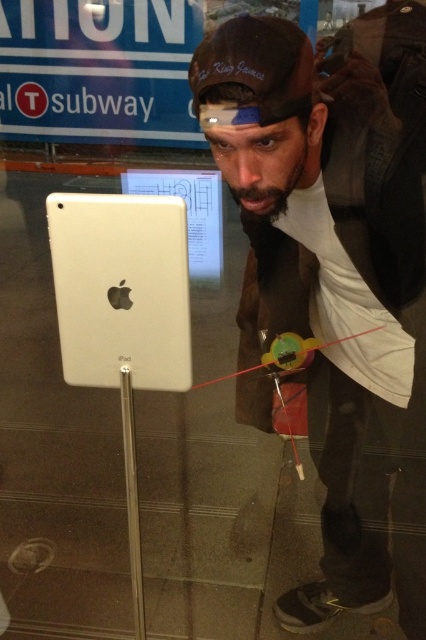
Question: Which point appears closest to the camera in this image?

Choices:
 (A) (368, 332)
 (B) (138, 529)

Answer: (B)

Question: Does white matte ipad at center appear over green plastic toy at center?

Choices:
 (A) yes
 (B) no

Answer: (A)

Question: Does white matte ipad at center have a lesser width compared to green plastic toy at center?

Choices:
 (A) yes
 (B) no

Answer: (B)

Question: Which object appears farthest from the camera in this image?

Choices:
 (A) silver metallic pole at center
 (B) white matte ipad at center
 (C) green plastic toy at center

Answer: (C)

Question: Which point is farther to the camera?

Choices:
 (A) silver metallic pole at center
 (B) green plastic toy at center

Answer: (B)

Question: Is silver metallic pole at center to the left of green plastic toy at center from the viewer's perspective?

Choices:
 (A) no
 (B) yes

Answer: (B)